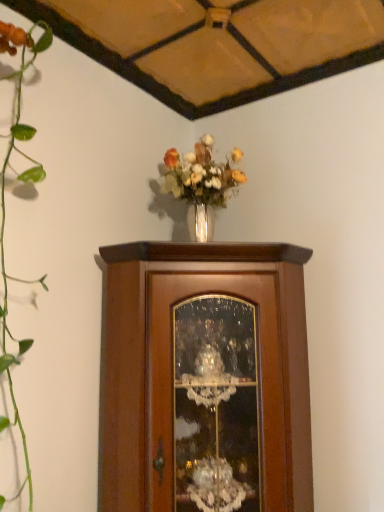
Where is `brown wooden cupboard at center`? This screenshot has height=512, width=384. brown wooden cupboard at center is located at coordinates (205, 379).

This screenshot has height=512, width=384. What do you see at coordinates (205, 379) in the screenshot?
I see `brown wooden cupboard at center` at bounding box center [205, 379].

This screenshot has height=512, width=384. What are the coordinates of `brown wooden cupboard at center` in the screenshot? It's located at (205, 379).